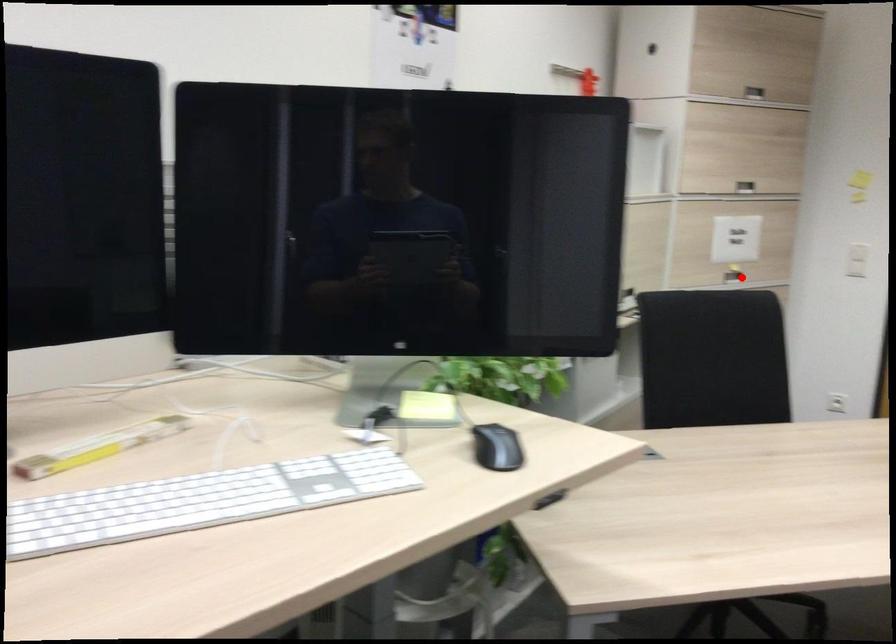
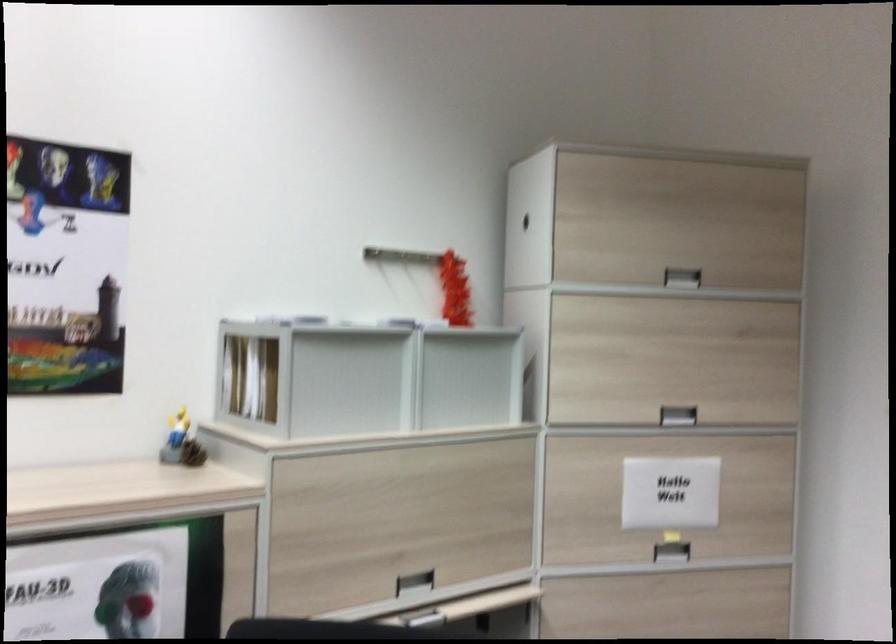
Locate, in the second image, the point that corresponds to the highlighted location in the first image.

(670, 552)